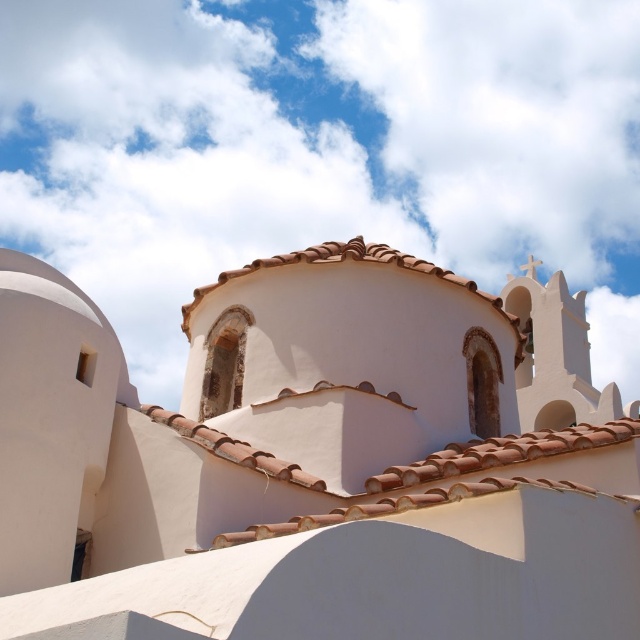
Who is higher up, white matte dome at center or brown clay tiles at upper center?

white matte dome at center is higher up.

Is white matte dome at center to the left of brown clay tiles at upper center from the viewer's perspective?

Incorrect, white matte dome at center is not on the left side of brown clay tiles at upper center.

Is point (362, 548) less distant than point (541, 454)?

Yes.

Find the location of a particular element. The height and width of the screenshot is (640, 640). white matte dome at center is located at coordinates (316, 460).

What do you see at coordinates (316, 460) in the screenshot? I see `white matte dome at center` at bounding box center [316, 460].

The width and height of the screenshot is (640, 640). What do you see at coordinates (316, 460) in the screenshot? I see `white matte dome at center` at bounding box center [316, 460].

I want to click on white matte dome at center, so click(x=316, y=460).

Can you confirm if white fluffy cloud at upper center is shorter than brown clay tiles at upper center?

Incorrect, white fluffy cloud at upper center's height does not fall short of brown clay tiles at upper center's.

Which is in front, point (113, 241) or point (362, 515)?

Point (362, 515)

Which is in front, point (196, 83) or point (484, 492)?

Positioned in front is point (484, 492).

The height and width of the screenshot is (640, 640). What are the coordinates of `white fluffy cloud at upper center` in the screenshot? It's located at [x=321, y=148].